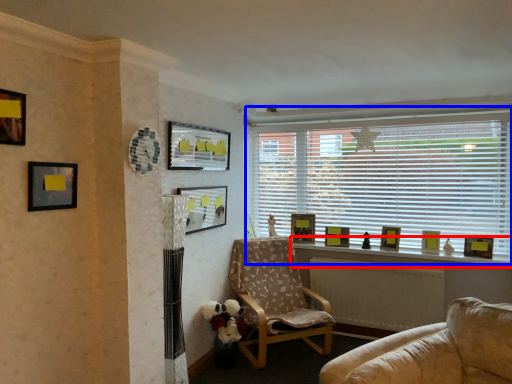
Question: Which of the following is the closest to the observer, window sill (highlighted by a red box) or window (highlighted by a blue box)?

Choices:
 (A) window sill
 (B) window

Answer: (A)